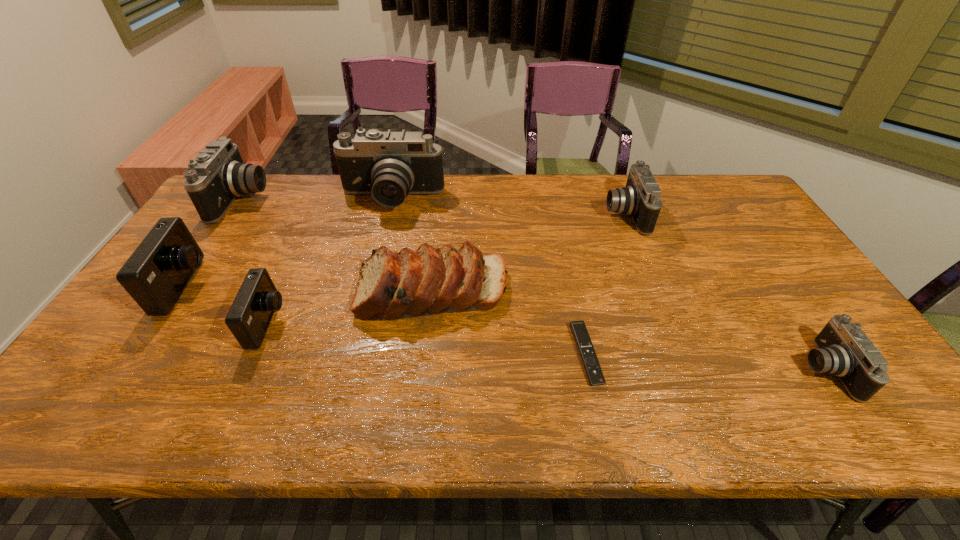
The height and width of the screenshot is (540, 960). I want to click on the nearest black camera, so click(x=843, y=349).

Find the location of a particular element. This screenshot has width=960, height=540. the smallest black camera is located at coordinates (843, 349).

Image resolution: width=960 pixels, height=540 pixels. Find the location of `the sixth object from left to right`. the sixth object from left to right is located at coordinates (579, 331).

The image size is (960, 540). I want to click on the shortest object, so click(579, 331).

At what (x,y) coordinates should I click in order to perform the action: click on vacant region located on the front-facing side of the third camera from right to left. Please return your answer as a coordinate pair (x, y). The width and height of the screenshot is (960, 540). Looking at the image, I should click on (372, 283).

Identify the location of free region located on the front-facing side of the third smallest black camera. (335, 200).

Find the location of `vacant space located 0.340m on the front-facing side of the bigger blue camera`. vacant space located 0.340m on the front-facing side of the bigger blue camera is located at coordinates (325, 286).

Where is `vacant position located 0.100m on the front-facing side of the second black camera from right to left`? The width and height of the screenshot is (960, 540). vacant position located 0.100m on the front-facing side of the second black camera from right to left is located at coordinates (575, 214).

This screenshot has width=960, height=540. What are the coordinates of `free space located 0.110m on the front-facing side of the second black camera from right to left` in the screenshot? It's located at (572, 214).

Find the location of a particular element. The width and height of the screenshot is (960, 540). blank area located 0.170m on the front-facing side of the second black camera from right to left is located at coordinates (555, 214).